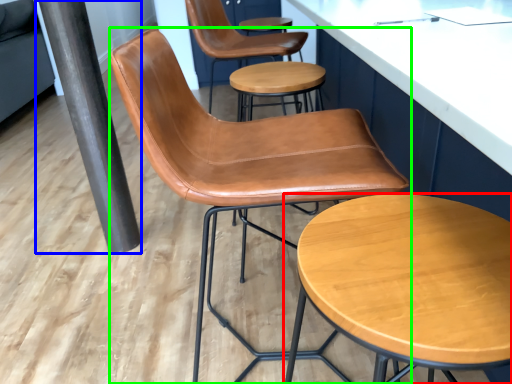
Question: Estimate the real-world distances between objects in this image. Which object is farther from stool (highlighted by a red box), beam (highlighted by a blue box) or chair (highlighted by a green box)?

Choices:
 (A) beam
 (B) chair

Answer: (A)